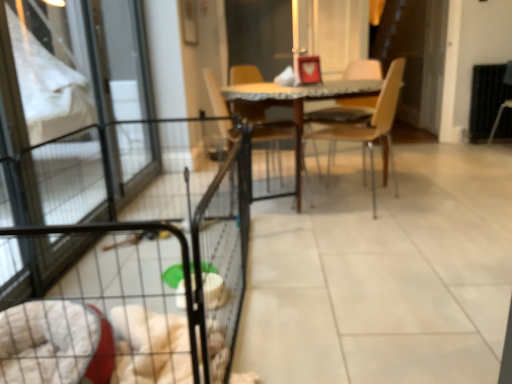
Where is `unoccupied region to the right of black wire cage at lower left`? The width and height of the screenshot is (512, 384). unoccupied region to the right of black wire cage at lower left is located at coordinates (387, 278).